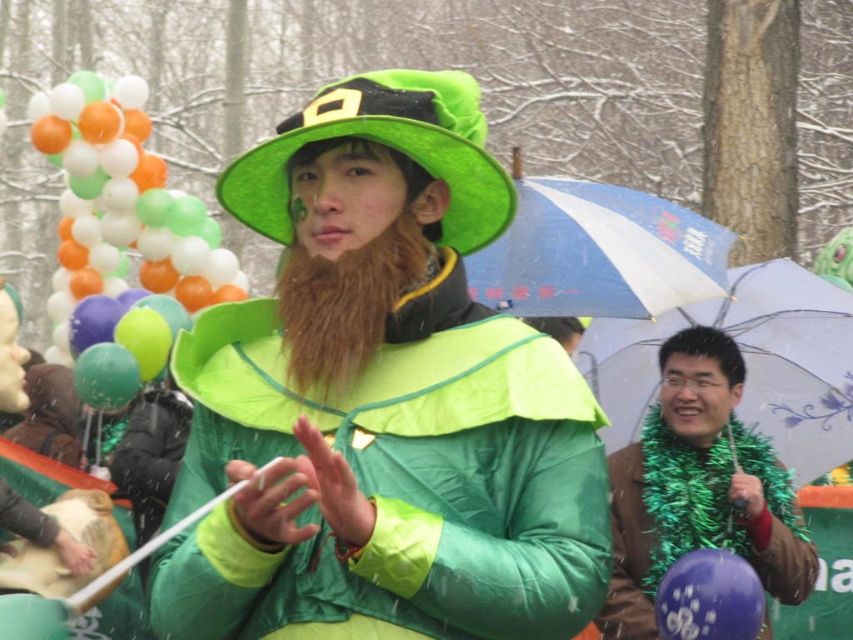
You are a photographer at the parade and want to capture the central figure without any hats overlapping. Since you see both the green matte hat at center and the green felt hat at center, which hat should you adjust your camera angle to avoid blocking the other?

The green matte hat at center is positioned under the green felt hat at center, so adjusting the camera angle to avoid the green felt hat at center would prevent blocking the green matte hat at center.

You are a photographer trying to capture the entire scene in one shot. You notice the brown leather jacket at lower right and the green felt hat at center. Which object is narrower in width?

The brown leather jacket at lower right has a lesser width compared to the green felt hat at center, so it is narrower.